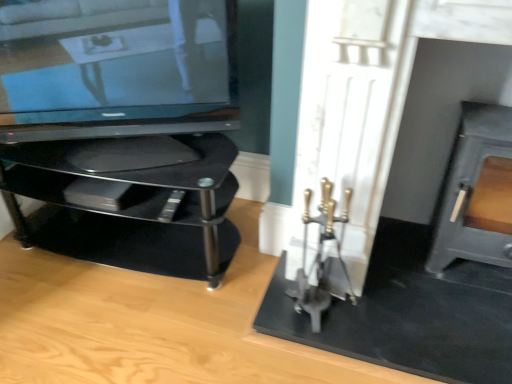
Question: Is matte gray fireplace at right in front of or behind satin black tv at left in the image?

Choices:
 (A) front
 (B) behind

Answer: (A)

Question: From a real-world perspective, is matte gray fireplace at right physically located above or below satin black tv at left?

Choices:
 (A) below
 (B) above

Answer: (A)

Question: Estimate the real-world distances between objects in this image. Which object is farther from the satin black tv at left?

Choices:
 (A) black glass tv stand at left
 (B) matte gray fireplace at right

Answer: (B)

Question: Estimate the real-world distances between objects in this image. Which object is closer to the satin black tv at left?

Choices:
 (A) black glass tv stand at left
 (B) matte gray fireplace at right

Answer: (A)